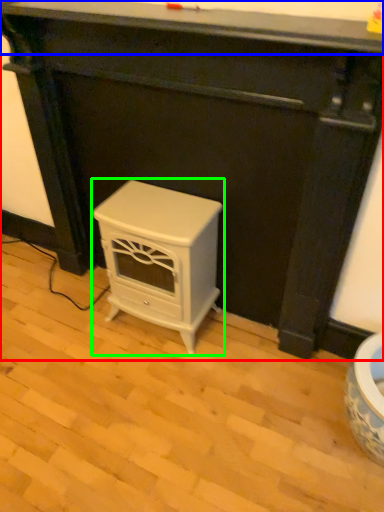
Question: Which object is the farthest from furniture (highlighted by a red box)? Choose among these: counter top (highlighted by a blue box) or furniture (highlighted by a green box).

Choices:
 (A) counter top
 (B) furniture

Answer: (A)